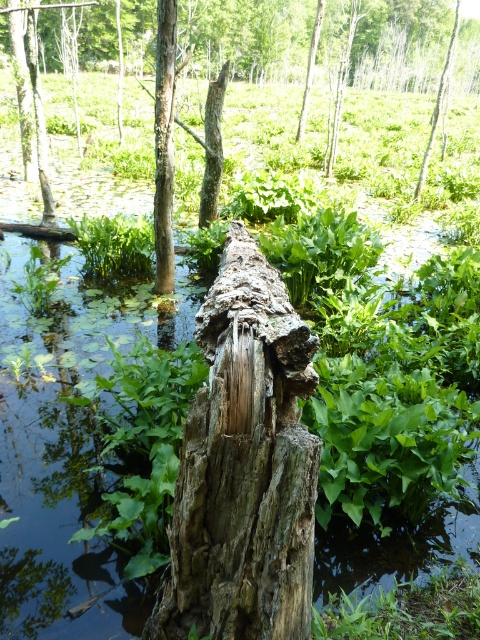
Which is above, weathered wood stump at center or smooth bark tree trunk at center?

smooth bark tree trunk at center is above.

Looking at this image, does weathered wood stump at center have a lesser height compared to smooth bark tree trunk at center?

Indeed, weathered wood stump at center has a lesser height compared to smooth bark tree trunk at center.

This screenshot has width=480, height=640. I want to click on weathered wood stump at center, so click(244, 465).